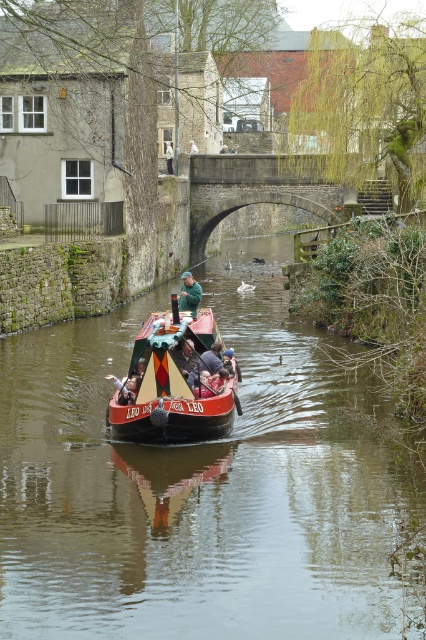
You are a photographer standing at the edge of the canal, and you want to take a photo of both the traditional red canal boat named Leo and the stone bridge in the background. You notice two points marked as point 1 and point 2 on your viewfinder. Point 1 is at coordinates point [184,300] and point 2 is at point [187,380]. Which point should you focus on to ensure both the boat and the bridge are in sharp focus?

You should focus on point 1 at point [184,300] because it is closer to the camera than point 2 at point [187,380]. By focusing on the closer point, the depth of field will extend further back, helping both the boat and the bridge remain in focus.

Consider the image. You are a photographer standing at the edge of the canal. You want to take a photo that includes both the smooth brown water at center and the matte black hat at center. Which object should you focus on first if you want to ensure both are in the frame?

The smooth brown water at center is bigger than the matte black hat at center, so you should focus on the smooth brown water at center first to ensure both fit in the frame.

You are a photographer standing on the stone bridge, and you want to take a photo of the passengers on the red canal boat named Leo. You notice two items at the center of the boat. Which item is wider between the green matte jacket at center and the matte black hat at center?

The green matte jacket at center is wider than the matte black hat at center.